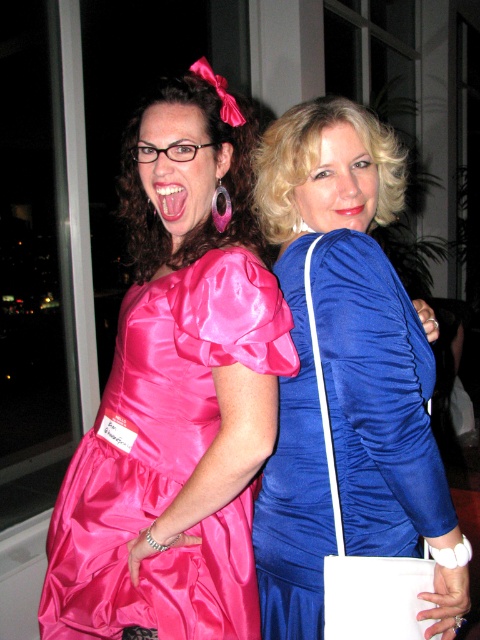
You are a photographer setting up for a photoshoot and need to position two dresses in the center of the frame. The blue satin dress at center and the shiny pink satin dress at center must be placed side by side. Given their widths, which dress should be placed on the left to ensure they both fit within the frame without overlapping?

The blue satin dress at center is thinner than the shiny pink satin dress at center, so placing the blue satin dress at center on the left allows both dresses to fit side by side within the frame without overlapping.

You are a photographer standing at the center of the room. You want to take a photo of the blue satin dress at center. Based on its position, where should you aim your camera?

The blue satin dress at center is located at coordinates point 0.586 on the x axis and 0.723 on the y axis, so you should aim your camera towards those coordinates to capture it.

You are a photographer at a formal event. You need to capture a photo where both the blue satin dress at center and the shiny pink satin dress at center are clearly visible. Based on their positions, which dress should you focus on first to ensure both are in frame?

The blue satin dress at center is above the shiny pink satin dress at center, so focusing on the blue satin dress at center first will ensure both are in frame as the shiny pink satin dress at center is positioned below it.